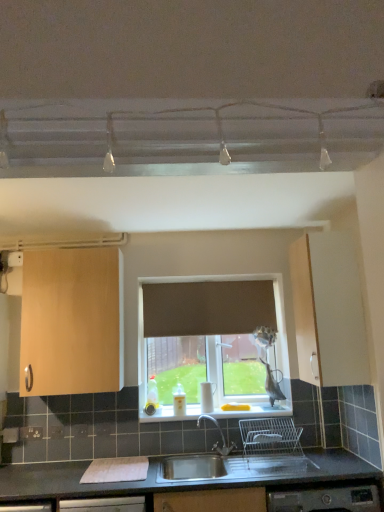
Question: Is light wood cabinet at left, which is the 2th cabinetry in right-to-left order, closer to the viewer compared to matte wood cabinet at right, the 2th cabinetry viewed from the left?

Choices:
 (A) no
 (B) yes

Answer: (A)

Question: Is light wood cabinet at left, positioned as the first cabinetry in left-to-right order, aimed at matte wood cabinet at right, which appears as the first cabinetry when viewed from the right?

Choices:
 (A) no
 (B) yes

Answer: (A)

Question: From the image's perspective, is light wood cabinet at left, positioned as the first cabinetry in left-to-right order, under matte wood cabinet at right, which appears as the first cabinetry when viewed from the right?

Choices:
 (A) no
 (B) yes

Answer: (B)

Question: Is light wood cabinet at left, positioned as the first cabinetry in left-to-right order, surrounding matte wood cabinet at right, the 2th cabinetry viewed from the left?

Choices:
 (A) yes
 (B) no

Answer: (B)

Question: Does light wood cabinet at left, positioned as the first cabinetry in left-to-right order, have a larger size compared to matte wood cabinet at right, which appears as the first cabinetry when viewed from the right?

Choices:
 (A) yes
 (B) no

Answer: (A)

Question: From a real-world perspective, is light wood cabinet at left, which is the 2th cabinetry in right-to-left order, positioned under matte wood cabinet at right, the 2th cabinetry viewed from the left, based on gravity?

Choices:
 (A) no
 (B) yes

Answer: (A)

Question: From a real-world perspective, is brown fabric curtain at center positioned over matte wood cabinet at right, the 2th cabinetry viewed from the left, based on gravity?

Choices:
 (A) no
 (B) yes

Answer: (B)

Question: Considering the relative positions of brown fabric curtain at center and matte wood cabinet at right, which appears as the first cabinetry when viewed from the right, in the image provided, is brown fabric curtain at center in front of matte wood cabinet at right, which appears as the first cabinetry when viewed from the right,?

Choices:
 (A) yes
 (B) no

Answer: (B)

Question: Could you tell me if brown fabric curtain at center is turned towards matte wood cabinet at right, which appears as the first cabinetry when viewed from the right?

Choices:
 (A) yes
 (B) no

Answer: (A)

Question: Does brown fabric curtain at center come behind matte wood cabinet at right, which appears as the first cabinetry when viewed from the right?

Choices:
 (A) yes
 (B) no

Answer: (A)

Question: Can matte wood cabinet at right, the 2th cabinetry viewed from the left, be found inside brown fabric curtain at center?

Choices:
 (A) no
 (B) yes

Answer: (A)

Question: Is brown fabric curtain at center with matte wood cabinet at right, which appears as the first cabinetry when viewed from the right?

Choices:
 (A) no
 (B) yes

Answer: (A)

Question: Does stainless steel sink at lower center have a greater width compared to white plastic electric outlet at lower left?

Choices:
 (A) yes
 (B) no

Answer: (A)